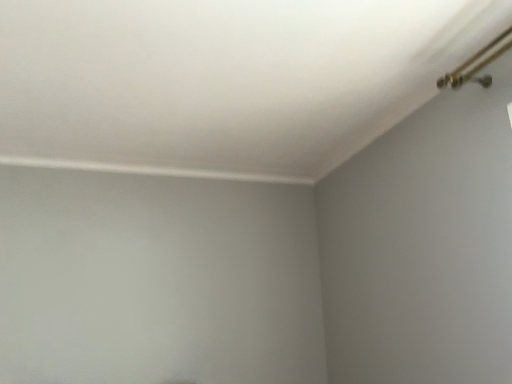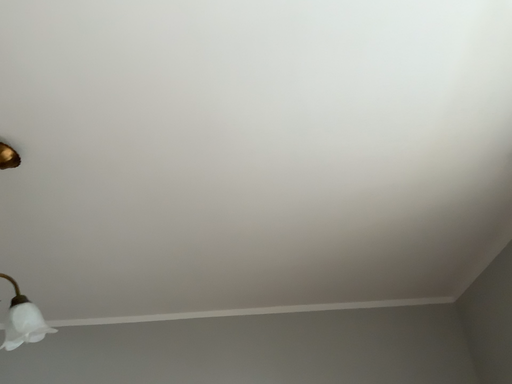
Question: Which way did the camera rotate in the video?

Choices:
 (A) rotated downward
 (B) rotated upward

Answer: (B)